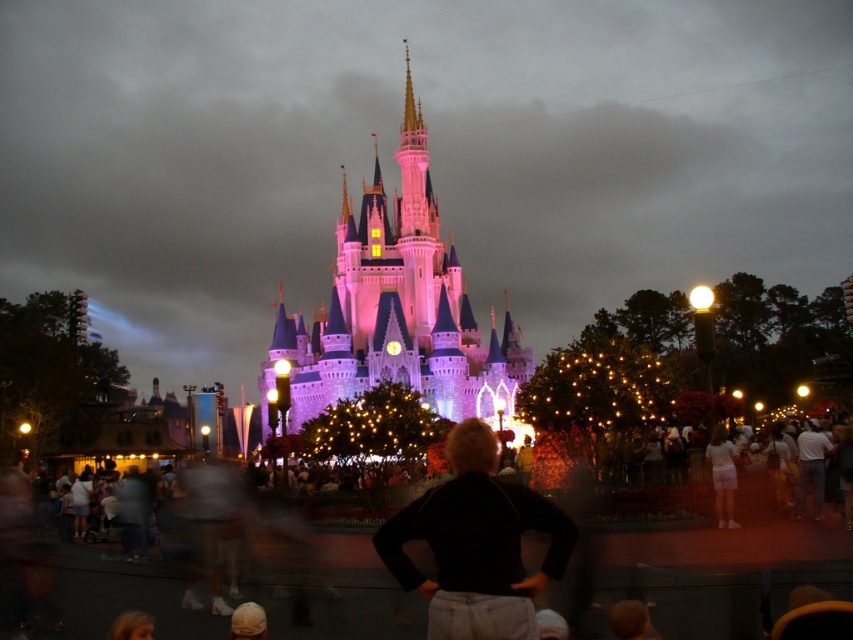
Is pink glossy castle at center below white cotton dress at center?

No, pink glossy castle at center is not below white cotton dress at center.

Is point (480, 349) less distant than point (732, 508)?

No, (480, 349) is behind (732, 508).

Find the location of a particular element. pink glossy castle at center is located at coordinates (398, 308).

Can you confirm if pink glossy castle at center is thinner than black cotton shirt at center?

In fact, pink glossy castle at center might be wider than black cotton shirt at center.

Is point (345, 214) positioned in front of point (436, 522)?

No, it is not.

At what (x,y) coordinates should I click in order to perform the action: click on pink glossy castle at center. Please return your answer as a coordinate pair (x, y). This screenshot has height=640, width=853. Looking at the image, I should click on (398, 308).

Does point (566, 545) come closer to viewer compared to point (717, 492)?

That is True.

Is point (393, 556) farther from camera compared to point (711, 452)?

No, it is not.

This screenshot has width=853, height=640. I want to click on black cotton shirt at center, so click(x=476, y=545).